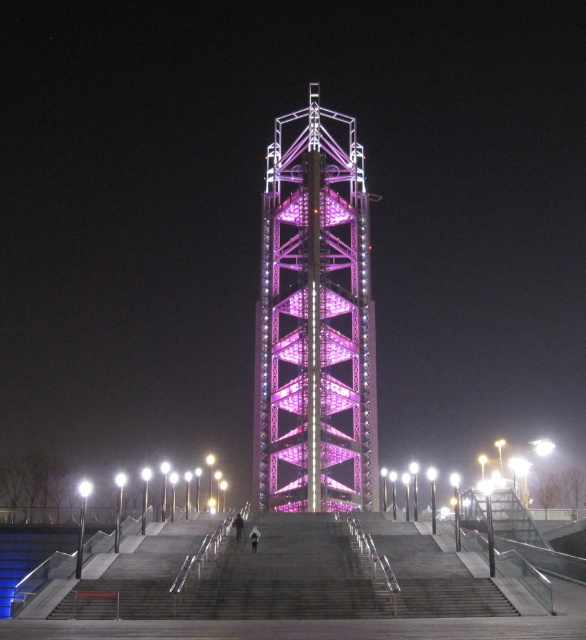
Question: Is purple metallic bell tower at center below pink metallic tower at center?

Choices:
 (A) yes
 (B) no

Answer: (B)

Question: Estimate the real-world distances between objects in this image. Which object is farther from the purple metallic bell tower at center?

Choices:
 (A) gray concrete stairs at center
 (B) pink metallic tower at center

Answer: (A)

Question: Is purple metallic bell tower at center to the right of gray concrete stairs at center from the viewer's perspective?

Choices:
 (A) no
 (B) yes

Answer: (B)

Question: Which object is the closest to the gray concrete stairs at center?

Choices:
 (A) pink metallic tower at center
 (B) purple metallic bell tower at center

Answer: (A)

Question: Can you confirm if purple metallic bell tower at center is positioned above gray concrete stairs at center?

Choices:
 (A) no
 (B) yes

Answer: (B)

Question: Which object is closer to the camera taking this photo?

Choices:
 (A) pink metallic tower at center
 (B) purple metallic bell tower at center

Answer: (A)